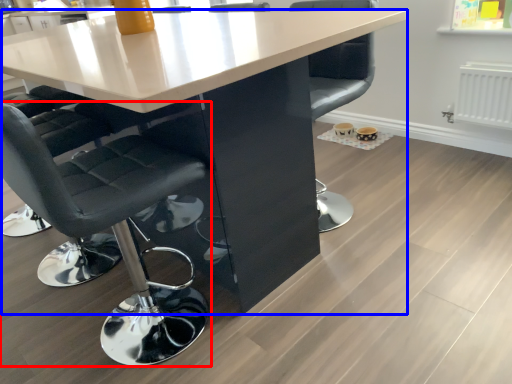
Question: Which object appears farthest to the camera in this image, chair (highlighted by a red box) or table (highlighted by a blue box)?

Choices:
 (A) chair
 (B) table

Answer: (A)